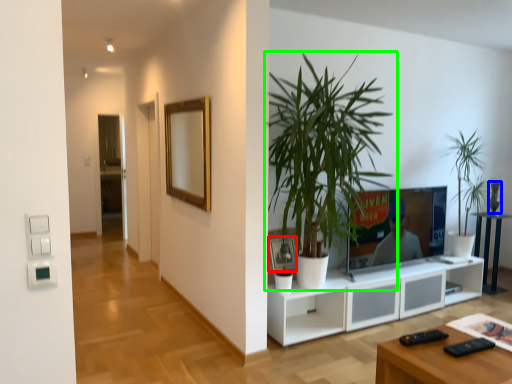
Question: Which object is positioned closest to picture frame (highlighted by a red box)? Select from vase (highlighted by a blue box) and houseplant (highlighted by a green box).

Choices:
 (A) vase
 (B) houseplant

Answer: (B)